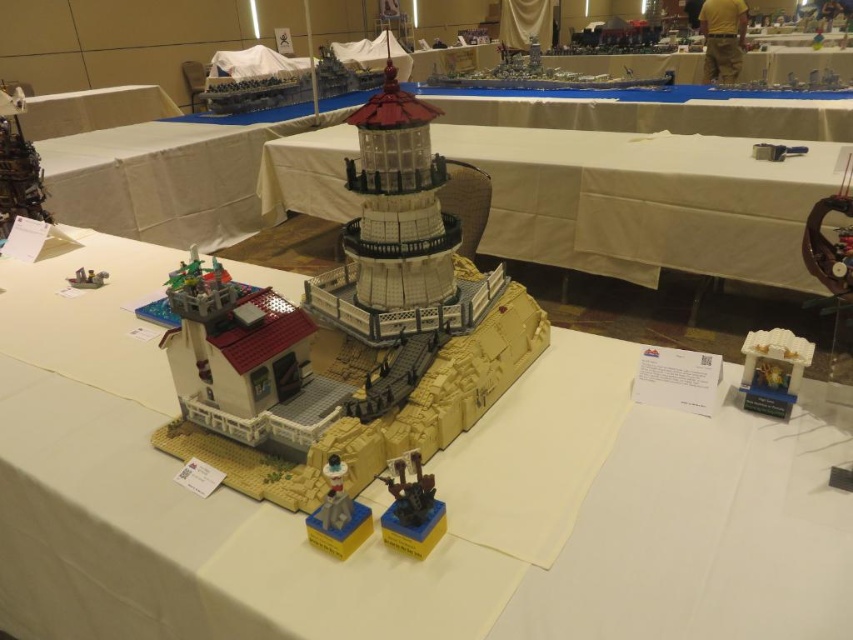
Question: Does white matte lego lighthouse at center have a smaller size compared to brick-like lego lighthouse at center?

Choices:
 (A) yes
 (B) no

Answer: (B)

Question: Can you confirm if white matte lego lighthouse at center is smaller than brick-like lego lighthouse at center?

Choices:
 (A) no
 (B) yes

Answer: (A)

Question: Based on their relative distances, which object is farther from the white matte lego lighthouse at center?

Choices:
 (A) brick-like lego lighthouse at center
 (B) white fabric table at upper left

Answer: (B)

Question: Which point is closer to the camera?

Choices:
 (A) (699, 554)
 (B) (683, 260)
 (C) (344, 294)
 (D) (142, 108)

Answer: (A)

Question: Does white matte lego lighthouse at center appear on the right side of white fabric at center?

Choices:
 (A) yes
 (B) no

Answer: (B)

Question: Which of these objects is positioned closest to the brick-like lego lighthouse at center?

Choices:
 (A) white fabric table at upper left
 (B) white matte lego lighthouse at center
 (C) white fabric at center

Answer: (B)